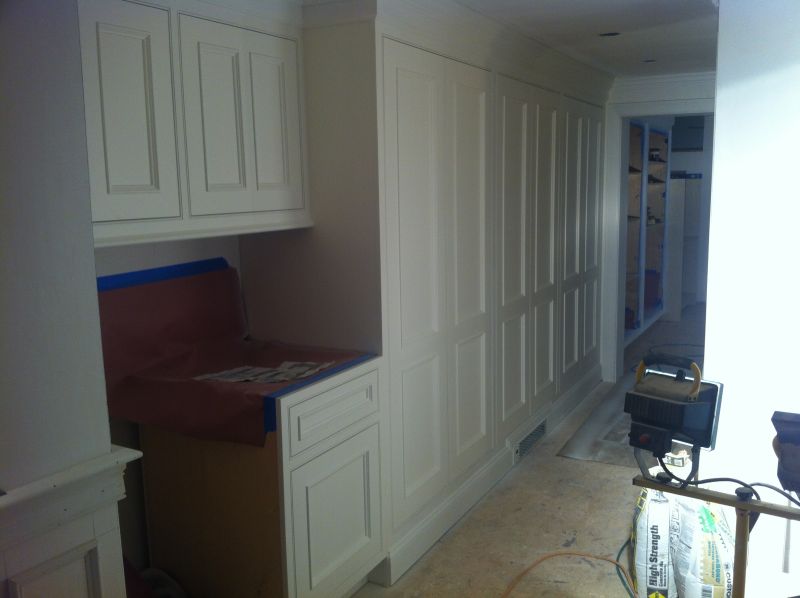
The height and width of the screenshot is (598, 800). Identify the location of top left cupboard. (110, 160).